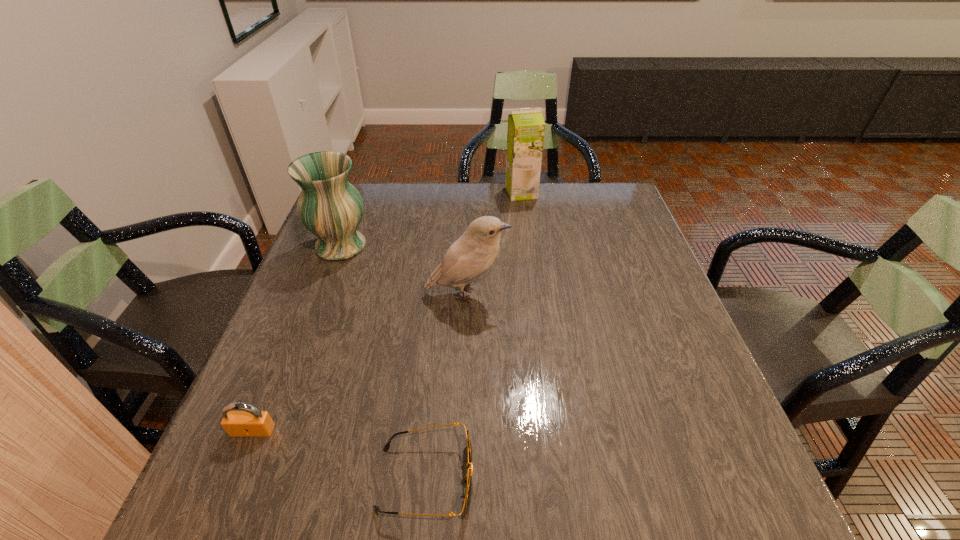
Locate an element on the screen. This screenshot has width=960, height=540. free region located 0.240m on the front-facing side of the sunglasses is located at coordinates [x=616, y=479].

Locate an element on the screen. The width and height of the screenshot is (960, 540). object that is at the far edge is located at coordinates (525, 136).

The width and height of the screenshot is (960, 540). Identify the location of object located in the near edge section of the desktop. (467, 479).

I want to click on vase present at the left edge, so click(331, 208).

Locate an element on the screen. This screenshot has width=960, height=540. padlock that is at the left edge is located at coordinates (248, 422).

In the image, there is a desktop. In order to click on vacant space at the far edge in this screenshot , I will do `click(477, 204)`.

Locate an element on the screen. This screenshot has width=960, height=540. vacant space at the near edge of the desktop is located at coordinates (638, 477).

The height and width of the screenshot is (540, 960). I want to click on free space at the left edge, so click(x=332, y=325).

Identify the location of vacant space at the right edge. This screenshot has width=960, height=540. (x=721, y=416).

What are the coordinates of `free location at the far right corner of the desktop` in the screenshot? It's located at (596, 211).